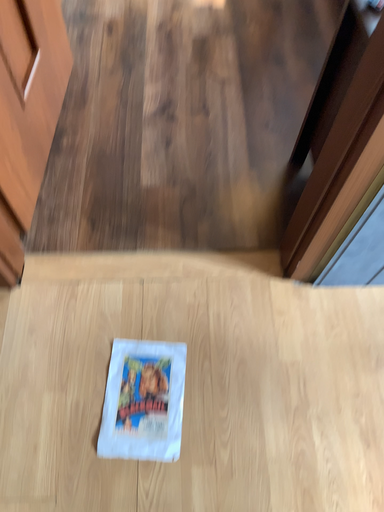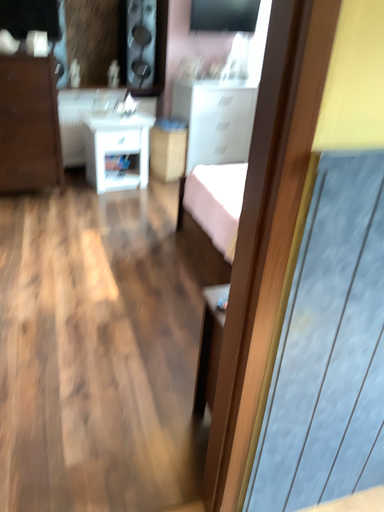
Question: How did the camera likely rotate when shooting the video?

Choices:
 (A) rotated right
 (B) rotated left

Answer: (A)